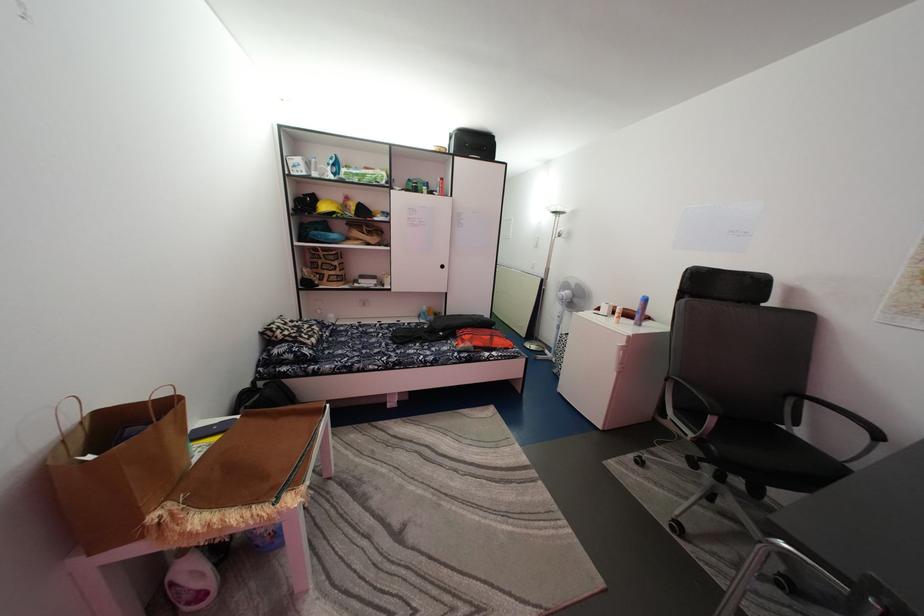
What do you see at coordinates (762, 447) in the screenshot?
I see `the chair sitting surface` at bounding box center [762, 447].